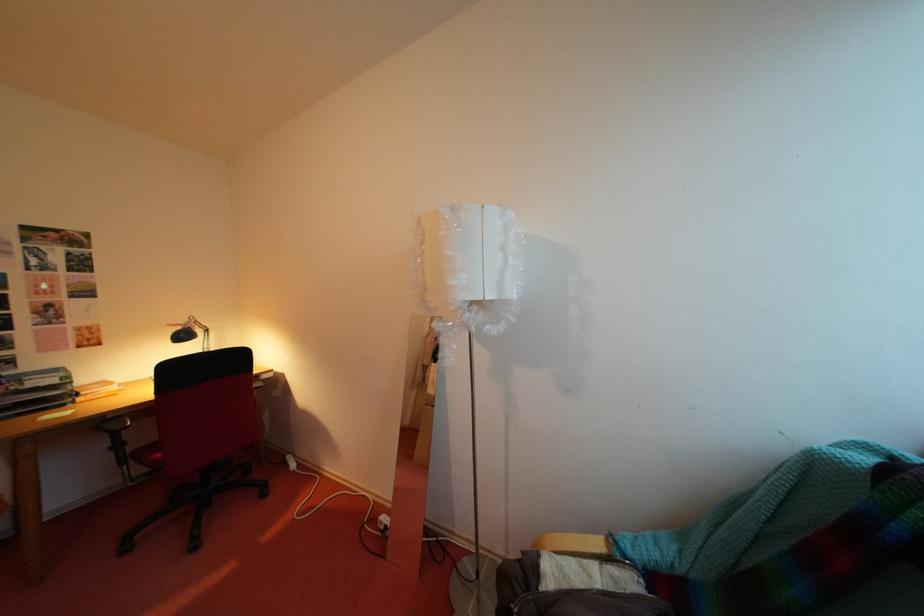
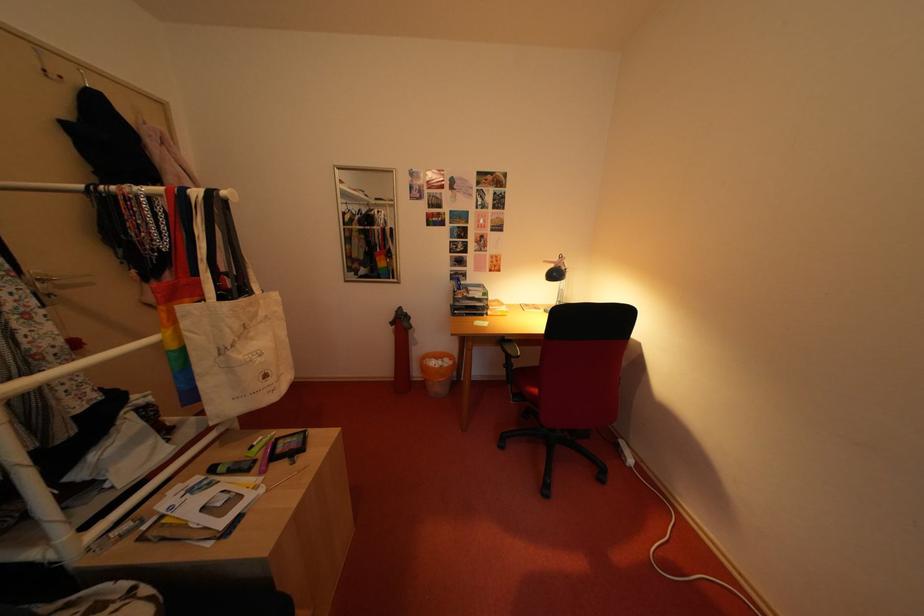
First-person continuous shooting, in which direction is the camera rotating?

The camera rotated toward left-down.